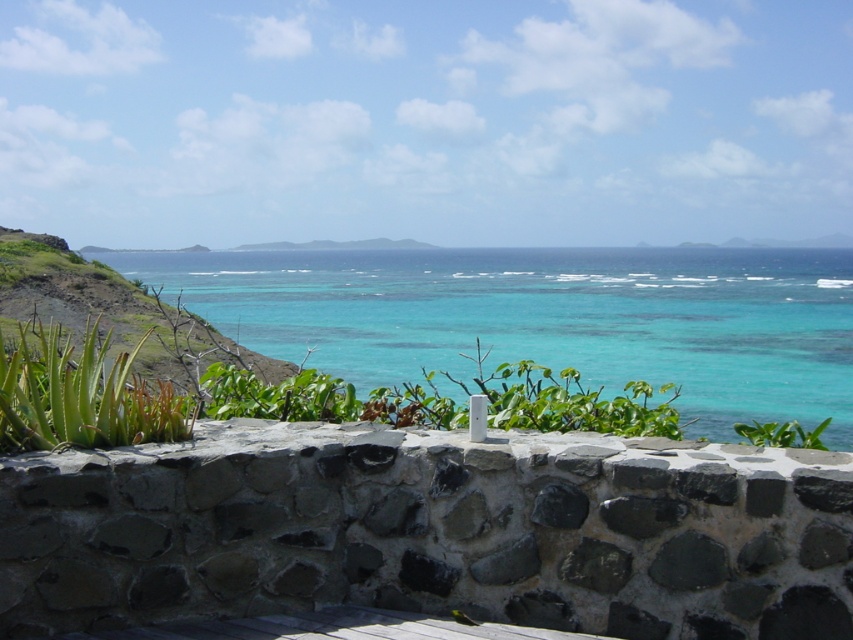
Can you confirm if gray stone ledge at center is shorter than green succulent at lower left?

Yes, gray stone ledge at center is shorter than green succulent at lower left.

Between gray stone ledge at center and green succulent at lower left, which one appears on the left side from the viewer's perspective?

green succulent at lower left is more to the left.

Image resolution: width=853 pixels, height=640 pixels. Find the location of `gray stone ledge at center`. gray stone ledge at center is located at coordinates (430, 531).

I want to click on gray stone ledge at center, so click(x=430, y=531).

Between point (404, 573) and point (848, 388), which one is positioned behind?

The point (848, 388) is more distant.

The image size is (853, 640). What do you see at coordinates (430, 531) in the screenshot?
I see `gray stone ledge at center` at bounding box center [430, 531].

What do you see at coordinates (430, 531) in the screenshot? This screenshot has height=640, width=853. I see `gray stone ledge at center` at bounding box center [430, 531].

I want to click on gray stone ledge at center, so click(430, 531).

Does point (525, 355) come closer to viewer compared to point (85, 332)?

No, it is not.

Can you confirm if turquoise water at center is positioned to the right of green succulent at lower left?

Yes, turquoise water at center is to the right of green succulent at lower left.

The image size is (853, 640). What are the coordinates of `turquoise water at center` in the screenshot? It's located at (547, 317).